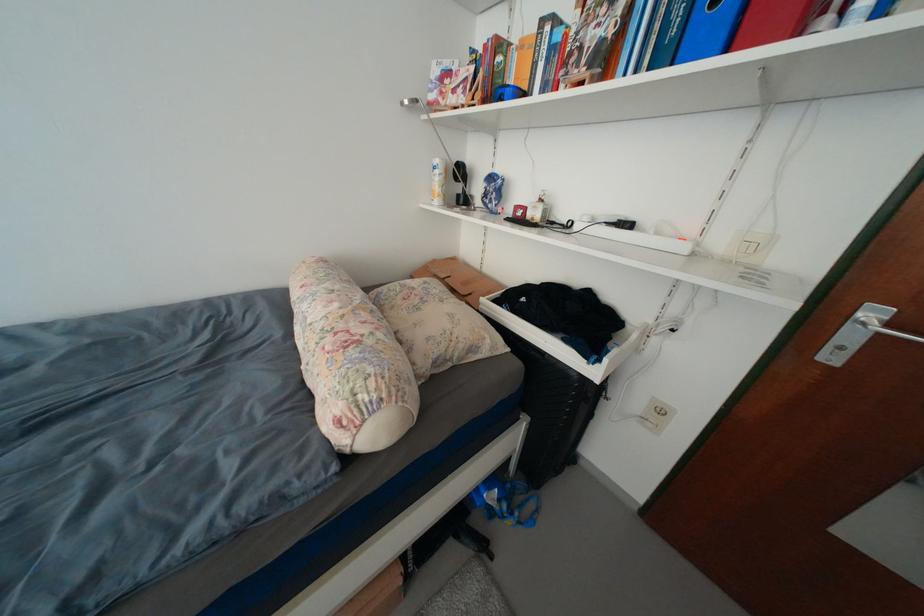
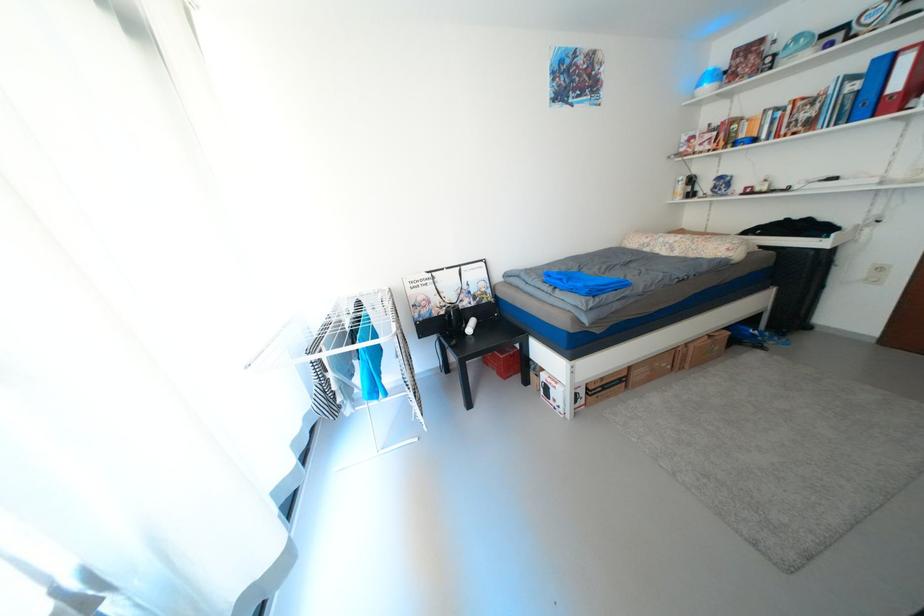
The images are taken continuously from a first-person perspective. In which direction are you moving?

The cameraman walked toward left, backward.